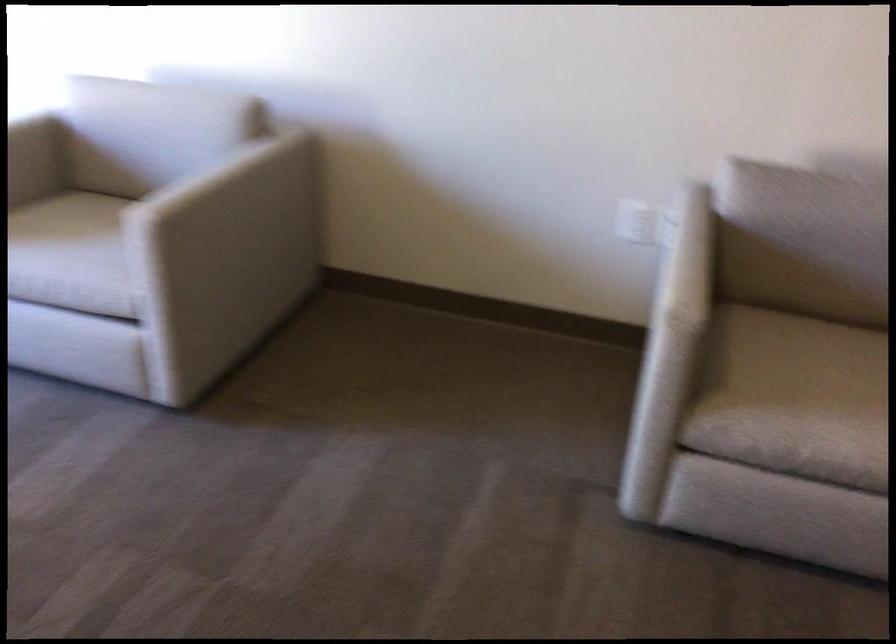
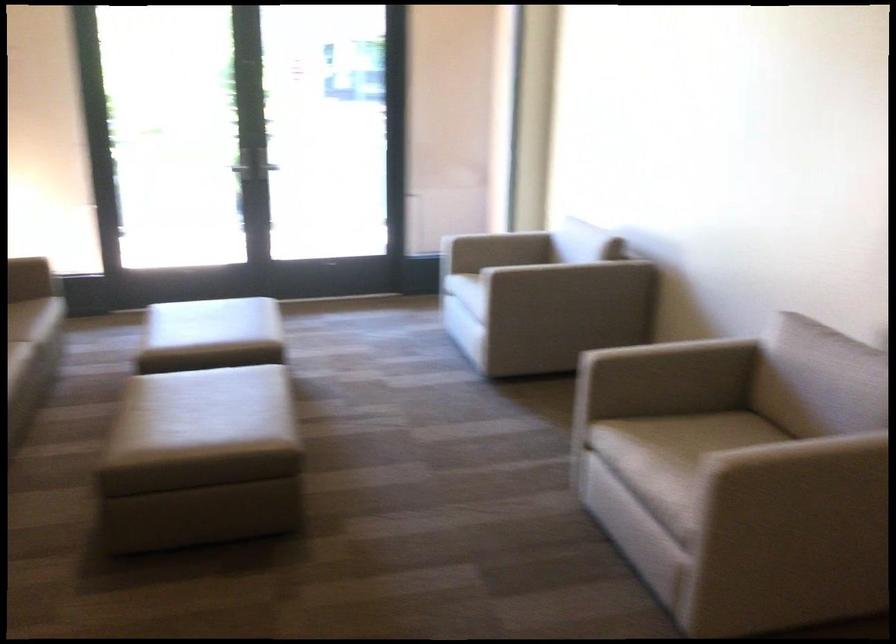
Locate, in the second image, the point that corresponds to the point at 209,180 in the first image.

(526, 261)